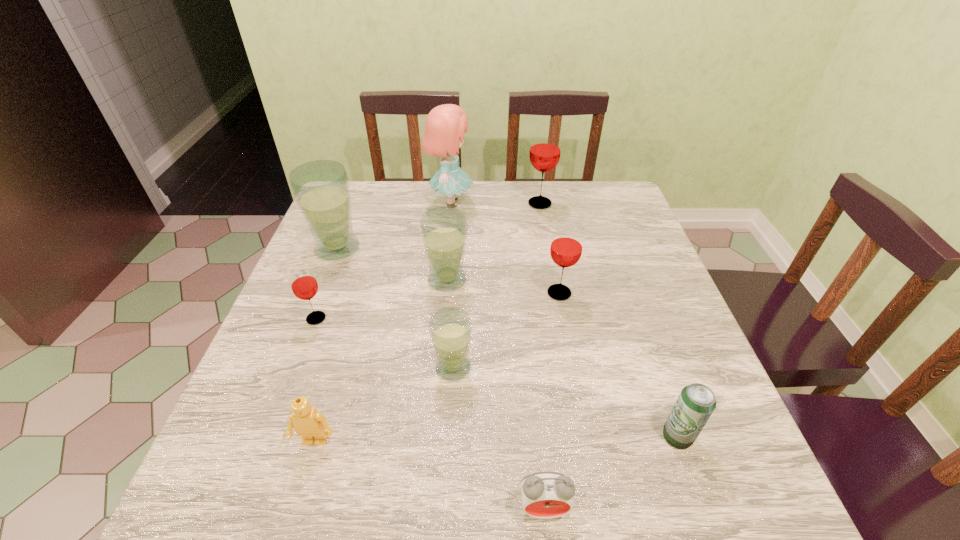
I want to click on free space at the far edge of the desktop, so click(411, 184).

In the image, there is a desktop. What are the coordinates of `free space at the near edge` in the screenshot? It's located at (512, 519).

In the image, there is a desktop. Where is `vacant space at the left edge`? Image resolution: width=960 pixels, height=540 pixels. vacant space at the left edge is located at coordinates (276, 372).

At what (x,y) coordinates should I click in order to perform the action: click on vacant space at the right edge of the desktop. Please return your answer as a coordinate pair (x, y). Image resolution: width=960 pixels, height=540 pixels. Looking at the image, I should click on (734, 461).

In the image, there is a desktop. Where is `vacant space at the far right corner`? vacant space at the far right corner is located at coordinates (601, 200).

I want to click on free space between the Lego and the beer can, so click(x=496, y=439).

This screenshot has width=960, height=540. Find the location of `vacant point located between the farthest red glass and the nearest glass`. vacant point located between the farthest red glass and the nearest glass is located at coordinates (496, 286).

Image resolution: width=960 pixels, height=540 pixels. What are the coordinates of `free space between the rightmost object and the sixth farthest object` in the screenshot? It's located at (496, 377).

The width and height of the screenshot is (960, 540). Identify the location of vacant space that is in between the second farthest red glass and the nearest glass. (x=506, y=330).

The width and height of the screenshot is (960, 540). I want to click on free point between the fourth object from right to left and the beer can, so click(611, 472).